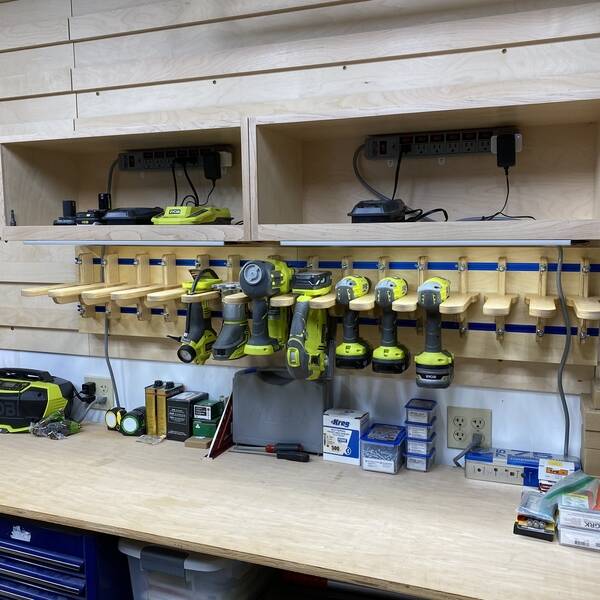
The image size is (600, 600). I want to click on power bar, so click(x=390, y=150), click(x=141, y=159).